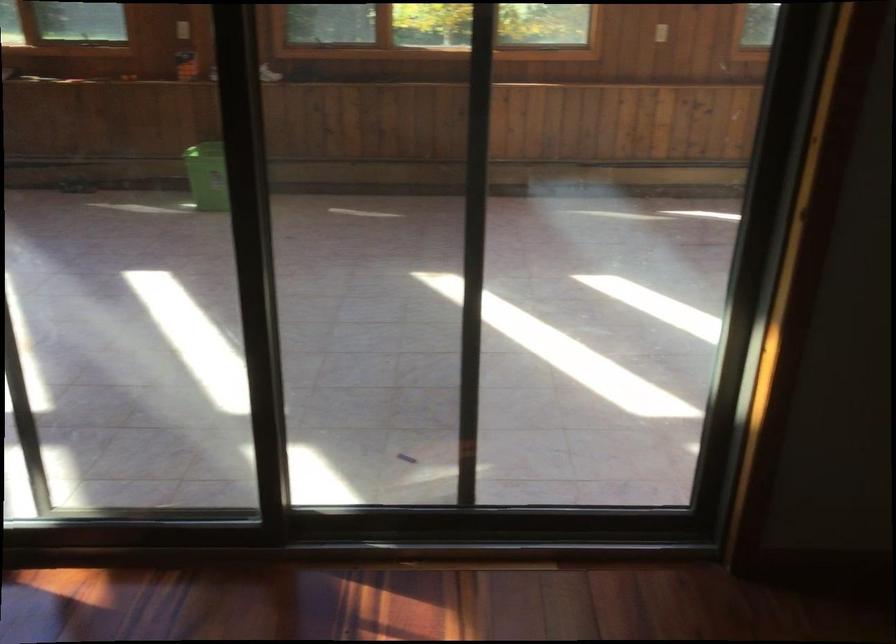
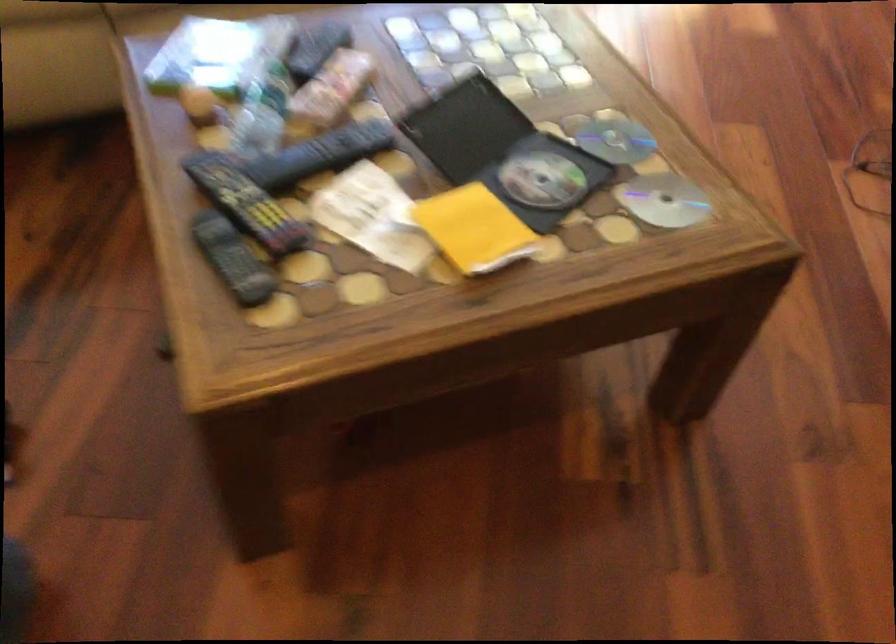
Question: Which direction would the cameraman need to move to produce the second image? Reply with the corresponding letter.

Choices:
 (A) Left
 (B) Right
 (C) Forward
 (D) Backward

Answer: (D)